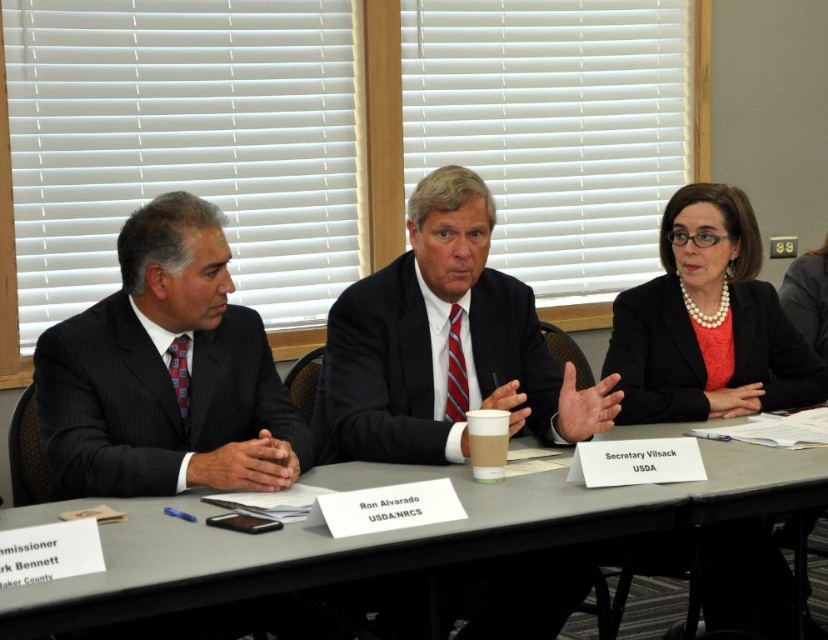
Question: Can you confirm if pinstriped suit at left is thinner than pearl necklace at upper right?

Choices:
 (A) yes
 (B) no

Answer: (A)

Question: Which object appears farthest from the camera in this image?

Choices:
 (A) pinstriped suit at left
 (B) gray plastic table at center

Answer: (A)

Question: Which point is farther to the camera?

Choices:
 (A) (51, 387)
 (B) (372, 420)

Answer: (B)

Question: Is pearl necklace at upper right bigger than matte black suit at center?

Choices:
 (A) yes
 (B) no

Answer: (A)

Question: Is pinstriped suit at left bigger than pearl necklace at upper right?

Choices:
 (A) no
 (B) yes

Answer: (B)

Question: Which point is farther to the camera?

Choices:
 (A) pinstriped suit at left
 (B) gray plastic table at center
 (C) black suit at center

Answer: (C)